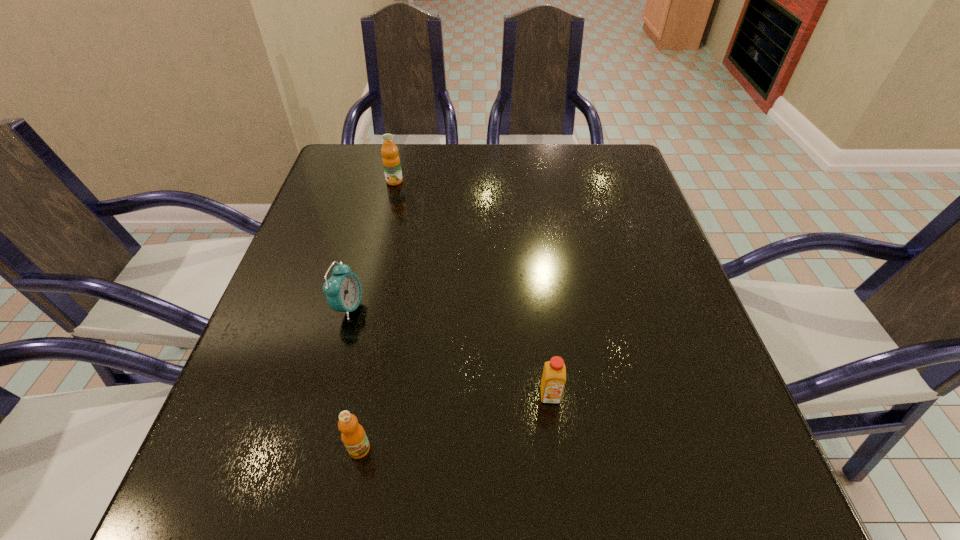
Where is `the second closest object to the tallest object`? the second closest object to the tallest object is located at coordinates (554, 374).

Point out which object is positioned as the nearest to the nearest orange juice. Please provide its 2D coordinates. Your answer should be formatted as a tuple, i.e. [(x, y)], where the tuple contains the x and y coordinates of a point satisfying the conditions above.

[(343, 290)]

Locate which orange juice ranks in proximity to the rightmost orange juice. Please provide its 2D coordinates. Your answer should be formatted as a tuple, i.e. [(x, y)], where the tuple contains the x and y coordinates of a point satisfying the conditions above.

[(353, 435)]

Find the location of `orange juice that is the third closest one to the second farthest object`. orange juice that is the third closest one to the second farthest object is located at coordinates (391, 162).